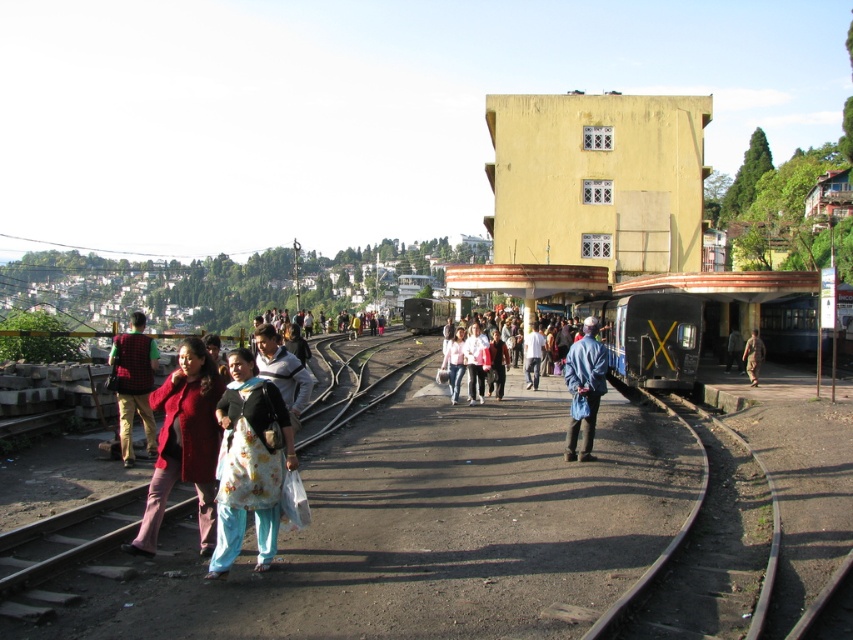
You are standing at the entrance of the yellowish station building with rectangular windows. You see a person wearing a matte red shirt at left. Based on their position coordinates, can you determine if they are closer to the station entrance or the curved railway track?

The matte red shirt at left is located at coordinates point (134,385). Since the entrance is part of the station building, and the railway track is in the foreground, the coordinates suggest the person is closer to the station entrance than the curved railway track.

You are standing at the entrance of the station and see two points on the platform. The first point is at coordinates point (196,458) and the second is at point (746,349). Which point is closer to you?

Point (196,458) is closer to you because it is in front of point (746,349).

You are a photographer standing on the platform at the railway station. You notice a matte red shirt at left and a light pink fabric at center. Which of these two items is shorter in height?

The matte red shirt at left has a lesser height compared to the light pink fabric at center, so the matte red shirt at left is shorter in height.